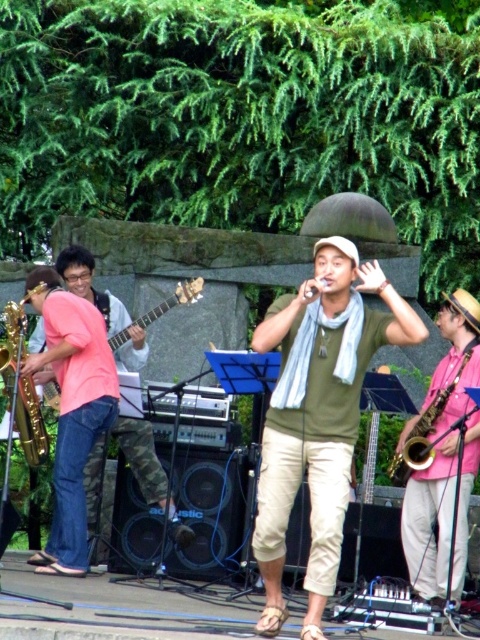
Is green matte shirt at center taller than pink matte saxophone at right?

Correct, green matte shirt at center is much taller as pink matte saxophone at right.

Who is positioned more to the right, green matte shirt at center or pink matte saxophone at right?

Positioned to the right is pink matte saxophone at right.

Is point (278, 328) behind point (459, 289)?

No, it is not.

What are the coordinates of `green matte shirt at center` in the screenshot? It's located at (317, 413).

Which is above, green matte shirt at center or matte pink guitar at left?

matte pink guitar at left

Can you confirm if green matte shirt at center is positioned above matte pink guitar at left?

Incorrect, green matte shirt at center is not positioned above matte pink guitar at left.

The width and height of the screenshot is (480, 640). I want to click on green matte shirt at center, so 317,413.

At what (x,y) coordinates should I click in order to perform the action: click on green matte shirt at center. Please return your answer as a coordinate pair (x, y). Looking at the image, I should click on (317, 413).

Does pink matte saxophone at right have a lesser height compared to satin gold saxophone at left?

In fact, pink matte saxophone at right may be taller than satin gold saxophone at left.

Does pink matte saxophone at right lie behind satin gold saxophone at left?

No, it is in front of satin gold saxophone at left.

Who is more forward, (448, 426) or (25, 428)?

Point (25, 428) is more forward.

In order to click on pink matte saxophone at right in this screenshot , I will do (430, 520).